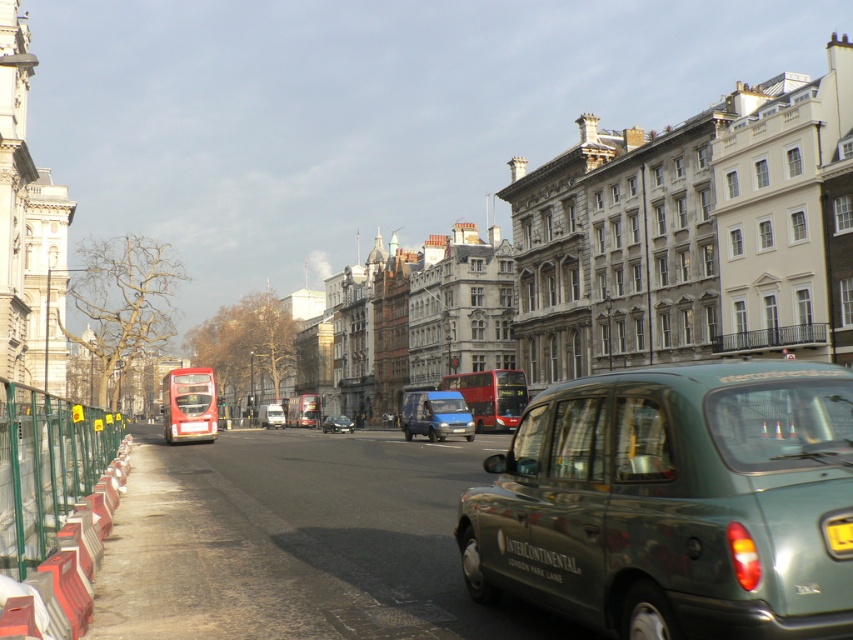
Question: Considering the real-world distances, which object is farthest from the red metallic bus at center?

Choices:
 (A) yellow plastic license plate at lower right
 (B) green matte taxi at center
 (C) yellow plastic license plate at center

Answer: (A)

Question: Does green matte taxi at center appear under yellow plastic license plate at center?

Choices:
 (A) yes
 (B) no

Answer: (B)

Question: Considering the real-world distances, which object is closest to the yellow plastic license plate at center?

Choices:
 (A) green matte taxi at center
 (B) red metallic bus at center
 (C) metallic blue van at center

Answer: (A)

Question: Where is red rubber double-decker bus at center located in relation to yellow plastic license plate at lower right in the image?

Choices:
 (A) below
 (B) above

Answer: (A)

Question: Is matte blue van at center wider than yellow plastic license plate at center?

Choices:
 (A) no
 (B) yes

Answer: (B)

Question: Among these points, which one is farthest from the camera?

Choices:
 (A) (294, 406)
 (B) (277, 417)
 (C) (503, 401)
 (D) (346, 420)

Answer: (A)